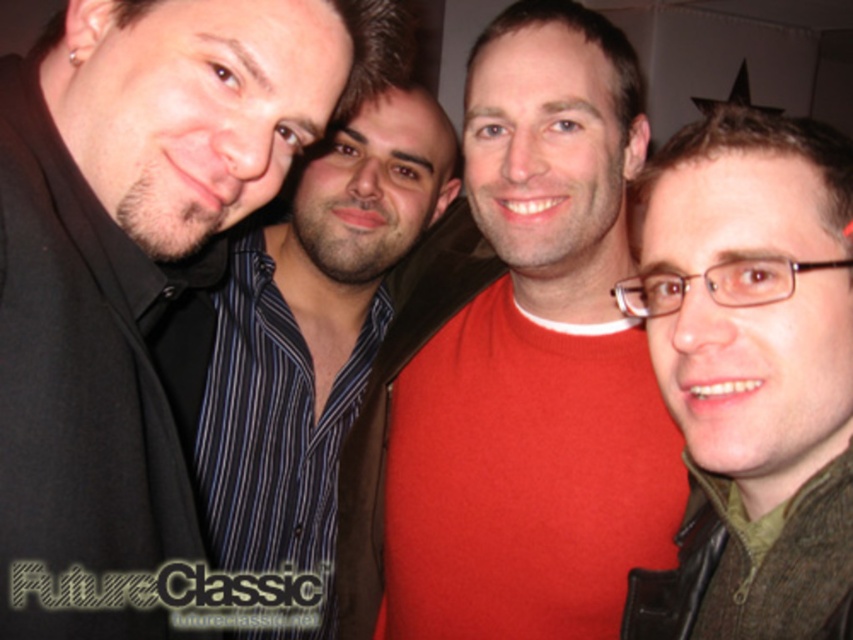
From the picture: You are a photographer trying to focus on the green wool sweater at right. The camera is currently focused on the point at coordinates point (752, 378). Is the sweater in focus?

Yes, the green wool sweater at right is located at point (752, 378), so the camera is focused on it.

You are at a party and want to take a photo with two friends wearing the red matte shirt at center and striped shirt at center. Based on their positions, which friend is standing lower in the photo?

The red matte shirt at center is located below striped shirt at center, so the friend wearing the red matte shirt at center is standing lower in the photo.

You are a photographer trying to adjust the lighting for a group photo. You notice a point at coordinates (517, 369) on the image. According to the scene description, what object is located at this point?

The point at coordinates (517, 369) indicates the red matte shirt at center.